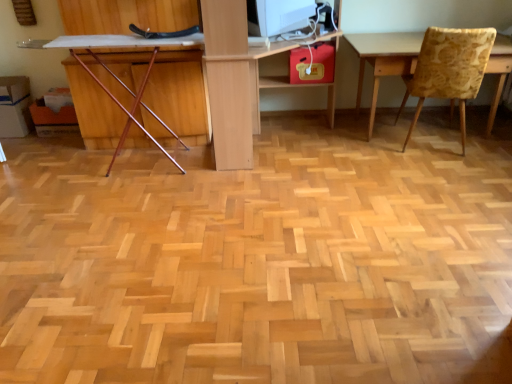
Locate an element on the screen. The height and width of the screenshot is (384, 512). vacant space in front of light wood computer desk at center is located at coordinates (291, 196).